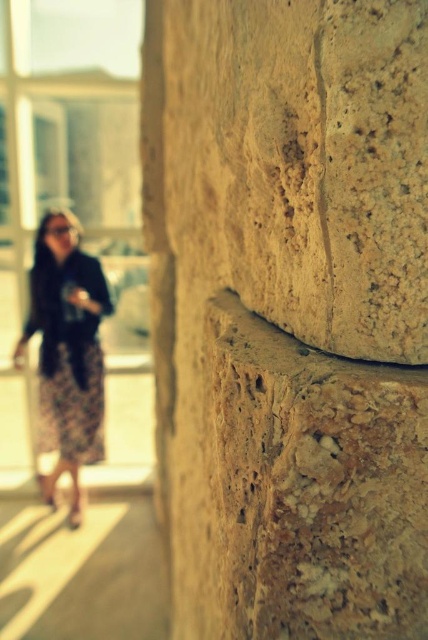
Who is lower down, natural stone wall at right or floral skirt at left?

floral skirt at left is lower down.

Between point (228, 48) and point (44, 349), which one is positioned in front?

Point (228, 48) is more forward.

Image resolution: width=428 pixels, height=640 pixels. I want to click on natural stone wall at right, so click(x=291, y=310).